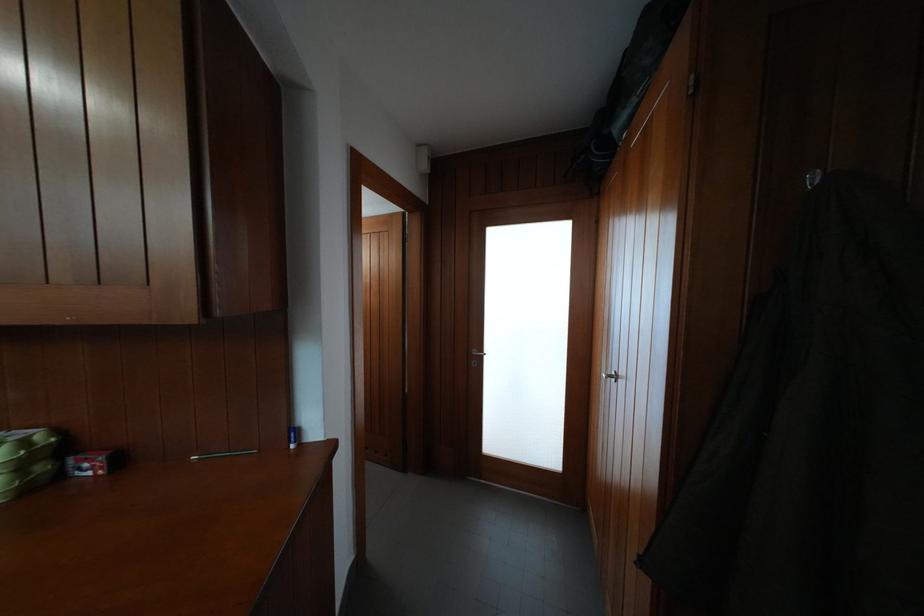
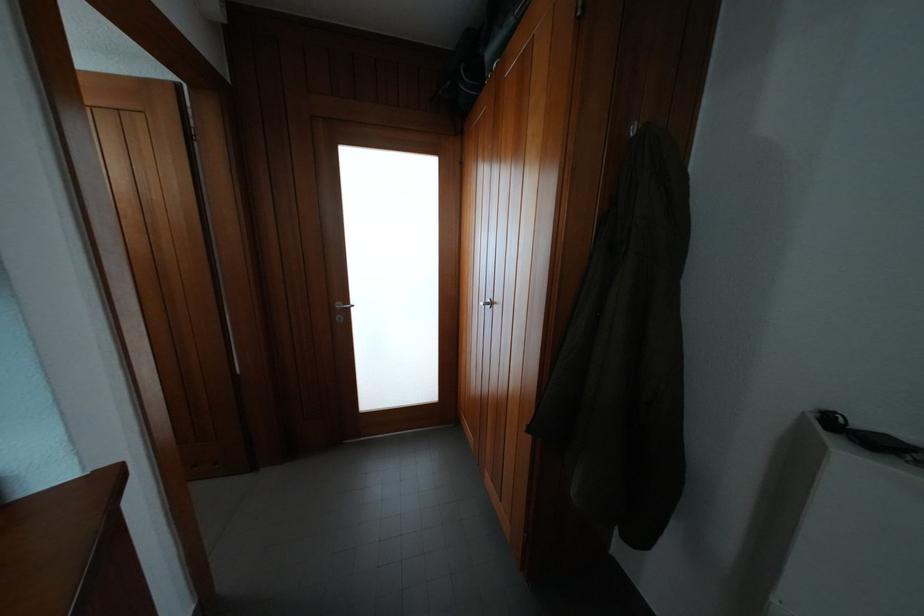
Question: The camera is either moving clockwise (left) or counter-clockwise (right) around the object. The first image is from the beginning of the video and the second image is from the end. Is the camera moving left or right when shooting the video?

Choices:
 (A) Left
 (B) Right

Answer: (A)